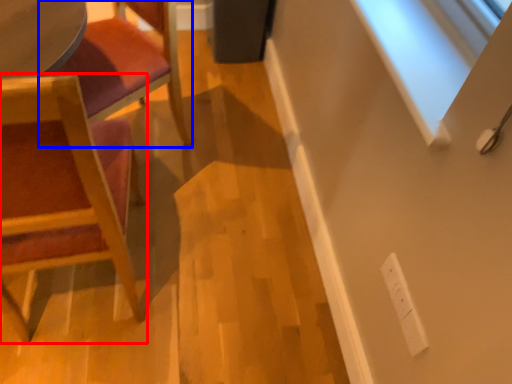
Question: Which object is further to the camera taking this photo, chair (highlighted by a red box) or chair (highlighted by a blue box)?

Choices:
 (A) chair
 (B) chair

Answer: (B)